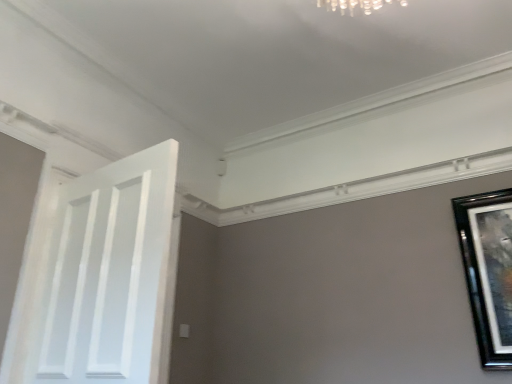
Question: Does point (147, 253) appear closer or farther from the camera than point (470, 297)?

Choices:
 (A) closer
 (B) farther

Answer: (A)

Question: From the image's perspective, relative to black glossy picture frame at right, is white painted wood door at left above or below?

Choices:
 (A) below
 (B) above

Answer: (B)

Question: In the image, is white painted wood door at left on the left side or the right side of black glossy picture frame at right?

Choices:
 (A) left
 (B) right

Answer: (A)

Question: From a real-world perspective, is black glossy picture frame at right positioned above or below white painted wood door at left?

Choices:
 (A) below
 (B) above

Answer: (B)

Question: In terms of width, does black glossy picture frame at right look wider or thinner when compared to white painted wood door at left?

Choices:
 (A) thin
 (B) wide

Answer: (A)

Question: Is point (506, 269) positioned closer to the camera than point (148, 253)?

Choices:
 (A) closer
 (B) farther

Answer: (B)

Question: Is black glossy picture frame at right in front of or behind white painted wood door at left in the image?

Choices:
 (A) front
 (B) behind

Answer: (B)